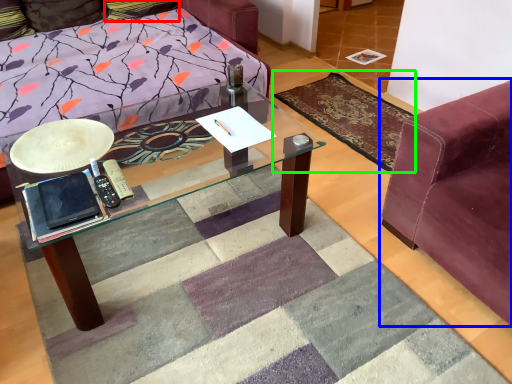
Question: Which is farther away from pillow (highlighted by a red box)? studio couch (highlighted by a blue box) or mat (highlighted by a green box)?

Choices:
 (A) studio couch
 (B) mat

Answer: (A)